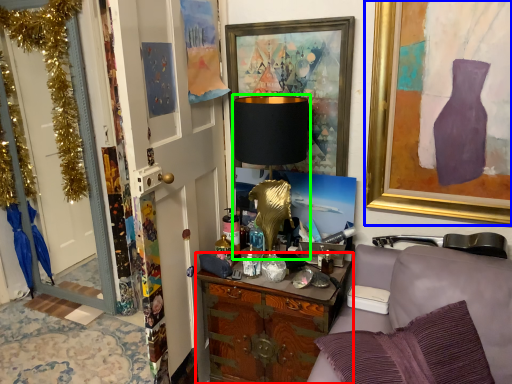
Question: Which object is the closest to the cabinetry (highlighted by a red box)? Choose among these: picture frame (highlighted by a blue box) or table lamp (highlighted by a green box).

Choices:
 (A) picture frame
 (B) table lamp

Answer: (B)